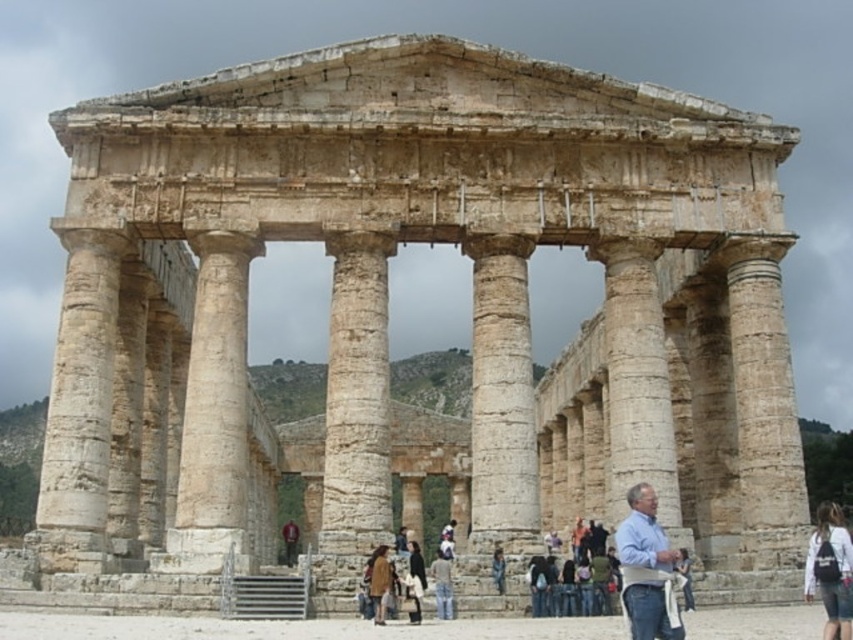
You are standing at the entrance of the ancient stone structure and want to take a photo of the white stone column at center. Based on your current position, is the column positioned to your left, right, or directly ahead?

The white stone column at center is located at point coordinates that place it directly ahead of your position at the entrance.